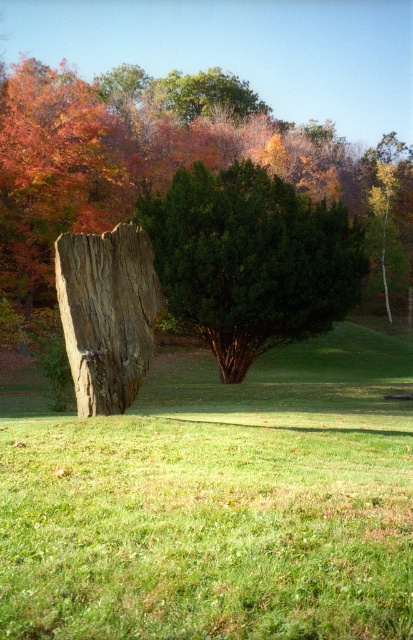
You are a gardener trying to determine which object has a smaller diameter. You see the wooden stump at center and the green leafy tree at upper center. Which one has a smaller diameter?

The wooden stump at center has a smaller diameter than the green leafy tree at upper center.

Based on the coordinates provided, what is located at point (215, 500) in the scene?

The point (215, 500) corresponds to green grass at center.

You are a gardener who wants to plant a new flower bed between the green grass at center and the green leafy tree at upper center. Which object should you place the flowers closer to so they get enough sunlight?

The green grass at center is not as tall as the green leafy tree at upper center, so placing the flowers closer to the green grass at center would allow them to receive more sunlight since the tree might cast a shadow over the area closer to it.